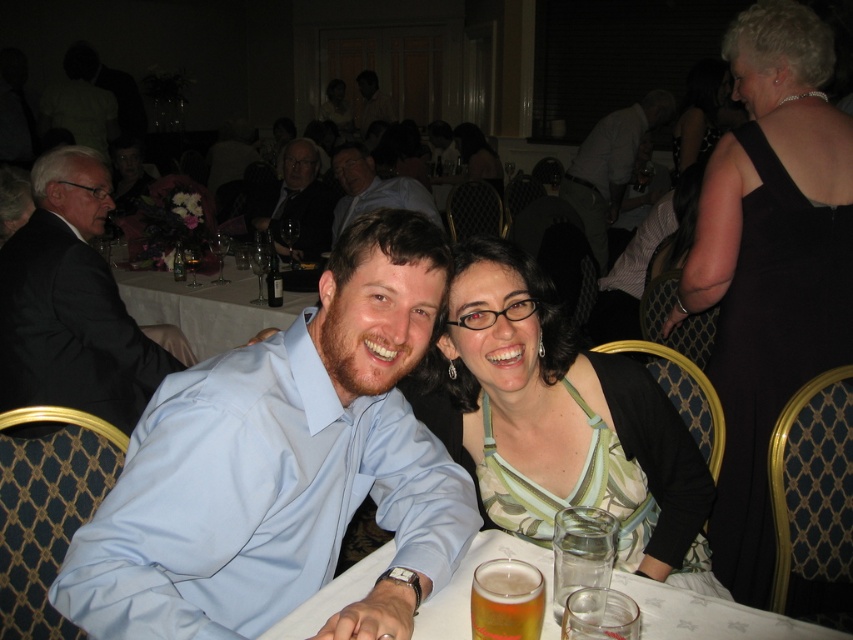
You are standing at the camera position and want to take a photo of the point at coordinate point (640, 516). Can you reach it with your hand if you extend it fully?

The point at coordinate point (640, 516) is 1.41 meters away from camera, so yes, you can reach it with your hand if you extend it fully since the average human arm length is about 0.7 meters.